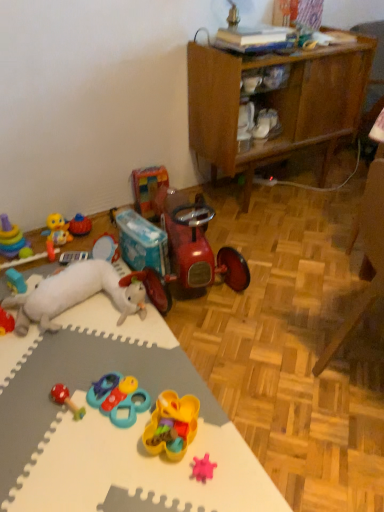
Find the location of a particular element. The image size is (384, 512). vacant region to the left of rubberized red and green toy at lower left, the 7th toy from the left is located at coordinates (28, 403).